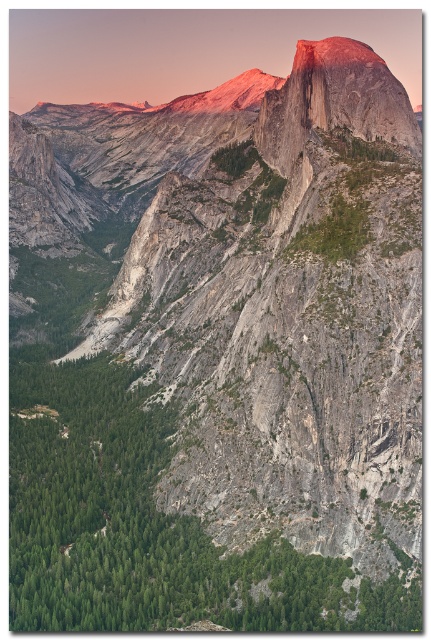
You are a geologist examining the image and want to locate the green rough rock at center. According to the coordinates provided, where exactly should you look on the image?

The green rough rock at center is located at the coordinates point (147,525).

You are a hiker planning to climb both the green rough rock at center and the matte granite peak at center. Based on their sizes, which one do you think requires more physical endurance to climb?

The green rough rock at center is bigger than the matte granite peak at center, so climbing the green rough rock at center would likely require more physical endurance.